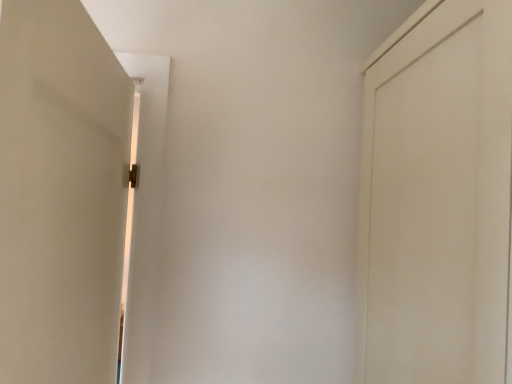
What do you see at coordinates (437, 200) in the screenshot?
I see `white matte door at right, which is the 2th door in left-to-right order` at bounding box center [437, 200].

Measure the distance between point [505,65] and camera.

Point [505,65] is 24.37 inches away from camera.

Find the location of `white matte door at right, which is the 2th door in left-to-right order`. white matte door at right, which is the 2th door in left-to-right order is located at coordinates (437, 200).

The width and height of the screenshot is (512, 384). In order to click on white matte door at left, the second door from the right in this screenshot , I will do `click(60, 194)`.

Describe the element at coordinates (60, 194) in the screenshot. I see `white matte door at left, the second door from the right` at that location.

Identify the location of white matte door at right, which is the 2th door in left-to-right order. (437, 200).

Considering the relative positions of white matte door at left, which is the first door in left-to-right order, and white matte door at right, which is the 2th door in left-to-right order, in the image provided, is white matte door at left, which is the first door in left-to-right order, to the left of white matte door at right, which is the 2th door in left-to-right order, from the viewer's perspective?

Correct, you'll find white matte door at left, which is the first door in left-to-right order, to the left of white matte door at right, which is the 2th door in left-to-right order.

Consider the image. Considering their positions, is white matte door at left, which is the first door in left-to-right order, located in front of or behind white matte door at right, acting as the 1th door starting from the right?

white matte door at left, which is the first door in left-to-right order, is in front of white matte door at right, acting as the 1th door starting from the right.

Is point (55, 175) behind point (379, 182)?

No.

Based on the photo, from the image's perspective, is white matte door at left, the second door from the right, under white matte door at right, acting as the 1th door starting from the right?

Correct, white matte door at left, the second door from the right, appears lower than white matte door at right, acting as the 1th door starting from the right, in the image.

From a real-world perspective, does white matte door at left, the second door from the right, stand above white matte door at right, which is the 2th door in left-to-right order?

No, from a real-world perspective, white matte door at left, the second door from the right, is not over white matte door at right, which is the 2th door in left-to-right order

Is white matte door at left, which is the first door in left-to-right order, thinner than white matte door at right, acting as the 1th door starting from the right?

Yes, white matte door at left, which is the first door in left-to-right order, is thinner than white matte door at right, acting as the 1th door starting from the right.

From their relative heights in the image, would you say white matte door at left, which is the first door in left-to-right order, is taller or shorter than white matte door at right, which is the 2th door in left-to-right order?

Clearly, white matte door at left, which is the first door in left-to-right order, is shorter compared to white matte door at right, which is the 2th door in left-to-right order.

Between white matte door at left, which is the first door in left-to-right order, and white matte door at right, which is the 2th door in left-to-right order, which one has larger size?

Bigger between the two is white matte door at right, which is the 2th door in left-to-right order.

Is white matte door at left, which is the first door in left-to-right order, situated inside white matte door at right, acting as the 1th door starting from the right, or outside?

white matte door at left, which is the first door in left-to-right order, lies outside white matte door at right, acting as the 1th door starting from the right.

Is white matte door at left, the second door from the right, beside white matte door at right, which is the 2th door in left-to-right order?

white matte door at left, the second door from the right, and white matte door at right, which is the 2th door in left-to-right order, are clearly separated.

Is white matte door at left, the second door from the right, positioned with its back to white matte door at right, which is the 2th door in left-to-right order?

Absolutely, white matte door at left, the second door from the right, is directed away from white matte door at right, which is the 2th door in left-to-right order.

Can you tell me how much white matte door at left, which is the first door in left-to-right order, and white matte door at right, which is the 2th door in left-to-right order, differ in facing direction?

white matte door at left, which is the first door in left-to-right order, and white matte door at right, which is the 2th door in left-to-right order, are facing 0.77 degrees away from each other.

You are a GUI agent. You are given a task and a screenshot of the screen. Output one action in this format:
    pyautogui.click(x=<x>, y=<y>)
    Task: Click on the door below the white matte door at right, acting as the 1th door starting from the right (from a real-world perspective)
    The width and height of the screenshot is (512, 384).
    Given the screenshot: What is the action you would take?
    pyautogui.click(x=60, y=194)

Which object is positioned more to the right, white matte door at right, acting as the 1th door starting from the right, or white matte door at left, which is the first door in left-to-right order?

From the viewer's perspective, white matte door at right, acting as the 1th door starting from the right, appears more on the right side.

Based on the photo, who is more distant, white matte door at right, acting as the 1th door starting from the right, or white matte door at left, the second door from the right?

white matte door at right, acting as the 1th door starting from the right, is further from the camera.

Is point (463, 346) positioned in front of point (42, 187)?

No, (463, 346) is behind (42, 187).

From the image's perspective, between white matte door at right, which is the 2th door in left-to-right order, and white matte door at left, which is the first door in left-to-right order, which one is located above?

white matte door at right, which is the 2th door in left-to-right order.

From a real-world perspective, is white matte door at right, acting as the 1th door starting from the right, positioned under white matte door at left, the second door from the right, based on gravity?

Actually, white matte door at right, acting as the 1th door starting from the right, is physically above white matte door at left, the second door from the right, in the real world.

Which object is wider, white matte door at right, acting as the 1th door starting from the right, or white matte door at left, which is the first door in left-to-right order?

Wider between the two is white matte door at right, acting as the 1th door starting from the right.

Considering the relative sizes of white matte door at right, acting as the 1th door starting from the right, and white matte door at left, the second door from the right, in the image provided, is white matte door at right, acting as the 1th door starting from the right, shorter than white matte door at left, the second door from the right,?

Incorrect, the height of white matte door at right, acting as the 1th door starting from the right, does not fall short of that of white matte door at left, the second door from the right.

Can you confirm if white matte door at right, which is the 2th door in left-to-right order, is bigger than white matte door at left, which is the first door in left-to-right order?

Indeed, white matte door at right, which is the 2th door in left-to-right order, has a larger size compared to white matte door at left, which is the first door in left-to-right order.

Is white matte door at right, acting as the 1th door starting from the right, surrounding white matte door at left, the second door from the right?

No, white matte door at left, the second door from the right, is not surrounded by white matte door at right, acting as the 1th door starting from the right.

Would you consider white matte door at right, which is the 2th door in left-to-right order, to be distant from white matte door at left, the second door from the right?

No, white matte door at right, which is the 2th door in left-to-right order, is in close proximity to white matte door at left, the second door from the right.

Is white matte door at right, acting as the 1th door starting from the right, aimed at white matte door at left, which is the first door in left-to-right order?

Yes.

Can you tell me how much white matte door at right, acting as the 1th door starting from the right, and white matte door at left, which is the first door in left-to-right order, differ in facing direction?

The angular difference between white matte door at right, acting as the 1th door starting from the right, and white matte door at left, which is the first door in left-to-right order, is 0.77 degrees.

How much distance is there between white matte door at right, which is the 2th door in left-to-right order, and white matte door at left, the second door from the right?

They are 63.61 centimeters apart.

Locate an element on the screen. The width and height of the screenshot is (512, 384). door that appears above the white matte door at left, which is the first door in left-to-right order (from a real-world perspective) is located at coordinates (437, 200).

The image size is (512, 384). What are the coordinates of `door above the white matte door at left, the second door from the right (from a real-world perspective)` in the screenshot? It's located at (437, 200).

This screenshot has width=512, height=384. What are the coordinates of `door on the right of white matte door at left, which is the first door in left-to-right order` in the screenshot? It's located at (437, 200).